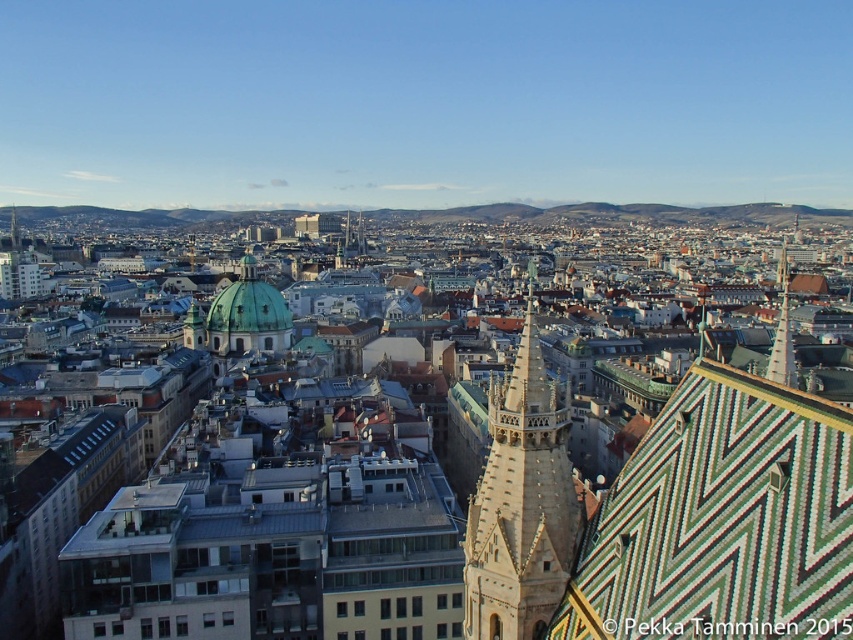
You are standing on a balcony overlooking the city and want to take a photo that includes both the green mosaic tile roof at upper right and the light brown stone tower at center. Given that your camera has a 50mm lens, which has a field of view of approximately 46 degrees, can you fit both objects into the frame without moving your position?

The green mosaic tile roof at upper right is 39.19 feet away from the light brown stone tower at center. Since the distance between them is within the camera lens field of view of 46 degrees, both objects can be captured in the same frame without moving your position.

Looking at this image, you are an architect analyzing the cityscape. You observe the green mosaic tile roof at upper right and the green glazed tile spire at upper right. Which of these two structures is positioned more to the east if the sun is setting in the west?

The green mosaic tile roof at upper right is to the left of the green glazed tile spire at upper right. Since the sun is setting in the west, the spire at the right would be more to the east, so the green glazed tile spire at upper right is positioned more to the east.